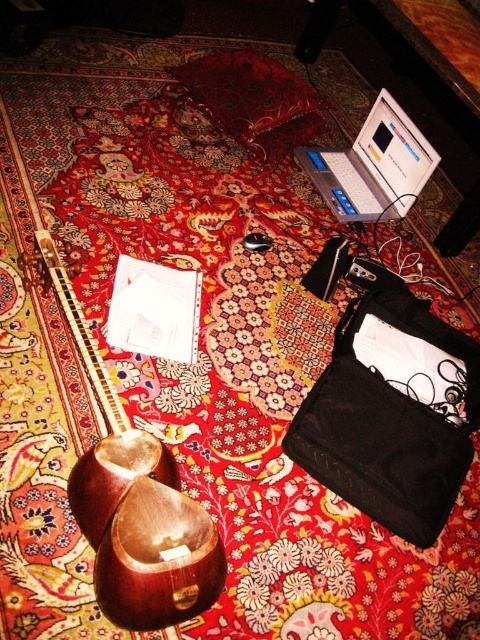
Question: Which object is closer to the camera taking this photo?

Choices:
 (A) silver metallic laptop at upper right
 (B) wooden stringed instrument at lower left

Answer: (B)

Question: Which of the following is the closest to the observer?

Choices:
 (A) black fabric bag at lower right
 (B) silver metallic laptop at upper right

Answer: (A)

Question: Is black fabric bag at lower right behind wooden stringed instrument at lower left?

Choices:
 (A) no
 (B) yes

Answer: (B)

Question: In this image, where is black fabric bag at lower right located relative to wooden stringed instrument at lower left?

Choices:
 (A) below
 (B) above

Answer: (A)

Question: Which of the following is the farthest from the observer?

Choices:
 (A) wooden stringed instrument at lower left
 (B) silver metallic laptop at upper right
 (C) black fabric bag at lower right

Answer: (B)

Question: Is wooden stringed instrument at lower left bigger than silver metallic laptop at upper right?

Choices:
 (A) no
 (B) yes

Answer: (B)